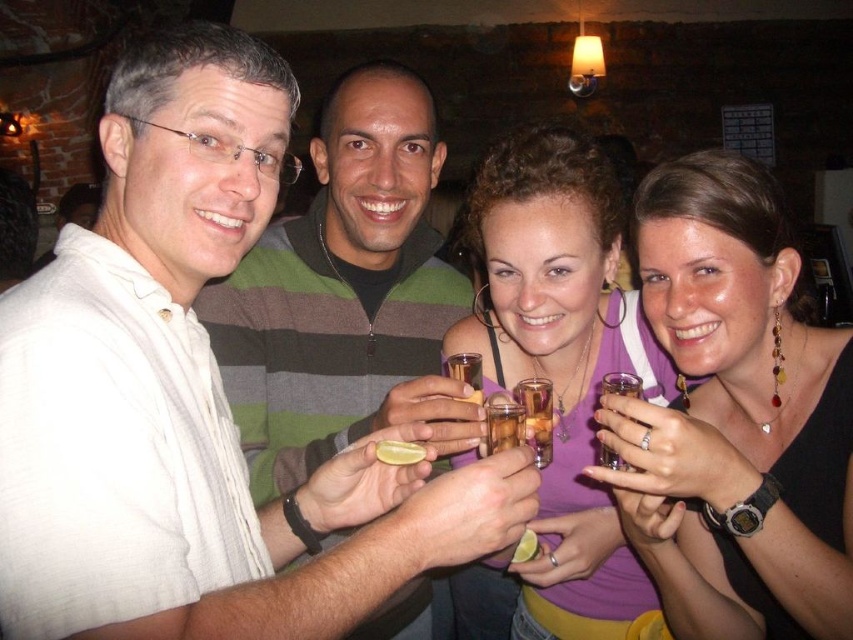
Question: Is matte black dress at center closer to the viewer compared to purple fabric tank top at center?

Choices:
 (A) no
 (B) yes

Answer: (B)

Question: Observing the image, what is the correct spatial positioning of matte black dress at center in reference to translucent glass shot glass at center?

Choices:
 (A) right
 (B) left

Answer: (A)

Question: Does white matte shirt at left come behind purple fabric tank top at center?

Choices:
 (A) yes
 (B) no

Answer: (B)

Question: Which of these objects is positioned closest to the translucent glass shot glass at center?

Choices:
 (A) matte black dress at center
 (B) white matte shirt at left

Answer: (A)

Question: Which point is closer to the camera?

Choices:
 (A) white matte shirt at left
 (B) translucent glass shot glass at center
 (C) purple fabric tank top at center

Answer: (B)

Question: Which point is farther from the camera taking this photo?

Choices:
 (A) [666, 260]
 (B) [515, 380]
 (C) [433, 413]

Answer: (B)